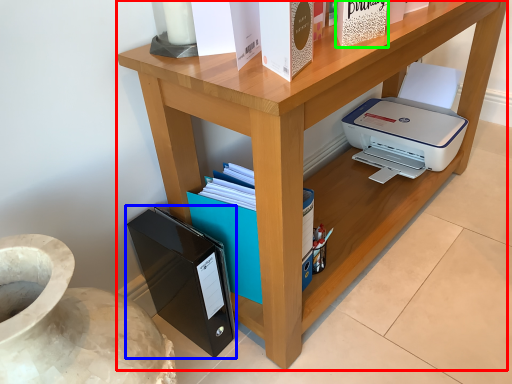
Question: Which object is the closest to the desk (highlighted by a red box)? Choose among these: paperback book (highlighted by a blue box) or paperback book (highlighted by a green box).

Choices:
 (A) paperback book
 (B) paperback book

Answer: (A)